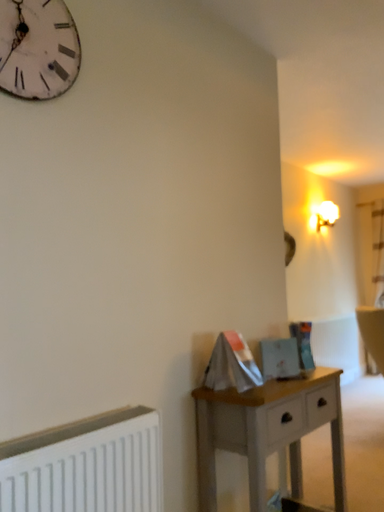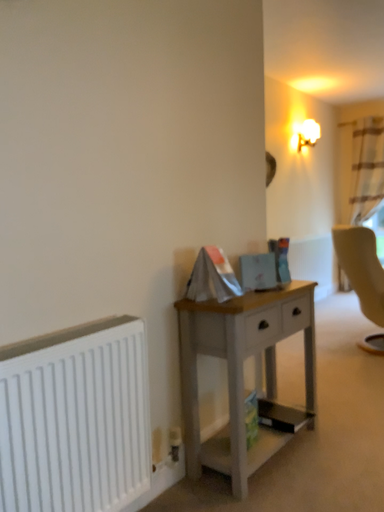
Question: How did the camera likely rotate when shooting the video?

Choices:
 (A) rotated upward
 (B) rotated downward

Answer: (B)